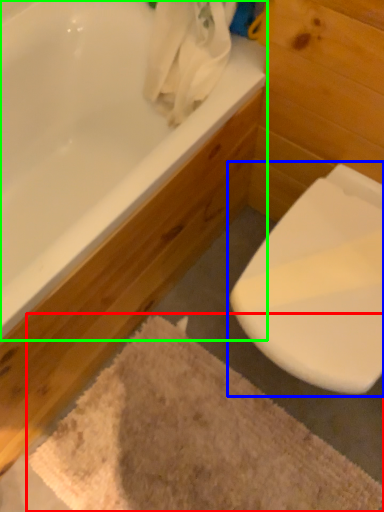
Question: Which object is positioned closest to bath mat (highlighted by a red box)? Select from toilet (highlighted by a blue box) and bathtub (highlighted by a green box).

Choices:
 (A) toilet
 (B) bathtub

Answer: (A)